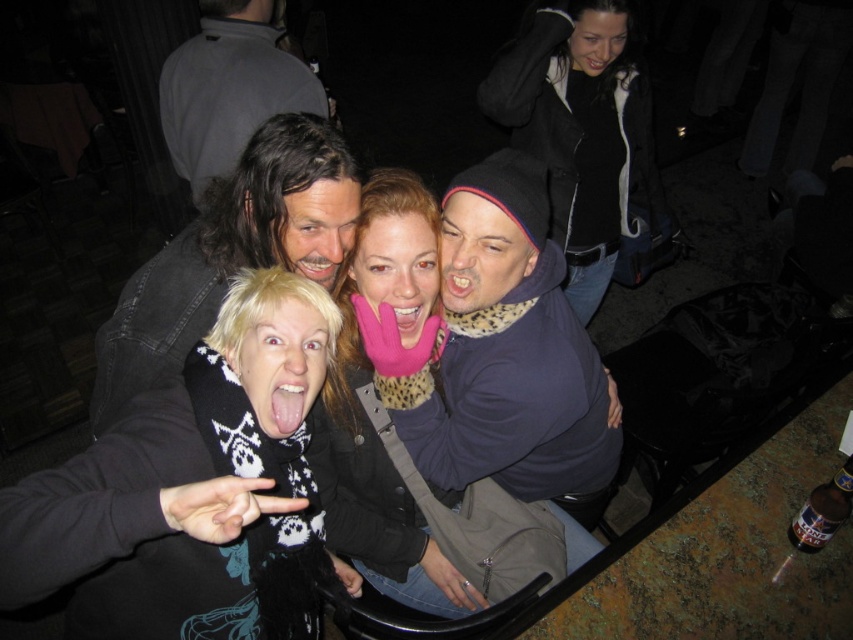
You are organizing a clothing donation drive and need to categorize items based on size. You have two items to sort out from the image provided. The first is the black and white scarf at lower left, and the second is the gray fabric at upper left. Which of these two items is smaller?

The black and white scarf at lower left is smaller than the gray fabric at upper left.